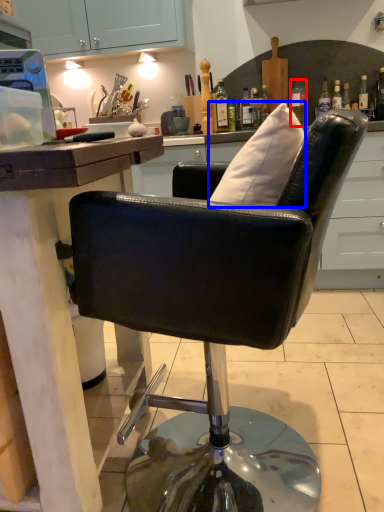
Question: Which point is closer to the camera, bottle (highlighted by a red box) or pillow (highlighted by a blue box)?

Choices:
 (A) bottle
 (B) pillow

Answer: (B)